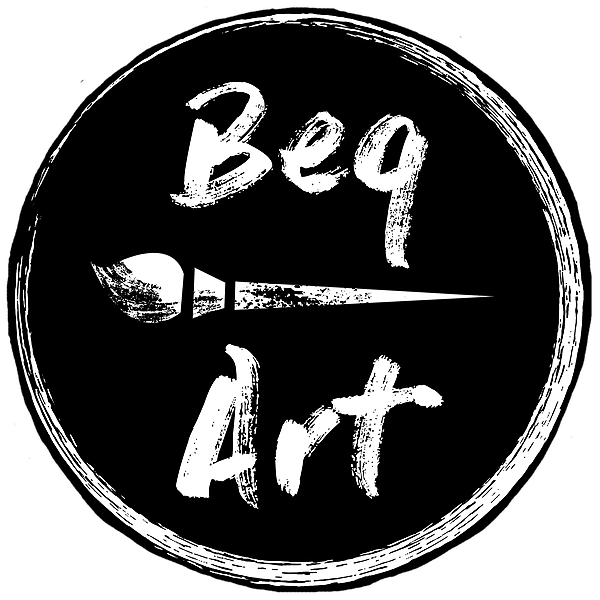
Find the location of a particular element. This screenshot has width=600, height=600. art is located at coordinates (201, 449).